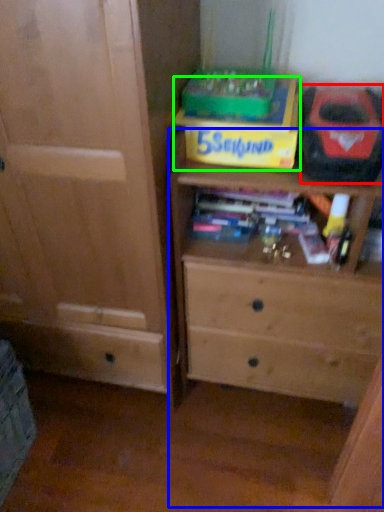
Question: Considering the real-world distances, which object is farthest from kit (highlighted by a red box)? chest of drawers (highlighted by a blue box) or cardboard box (highlighted by a green box)?

Choices:
 (A) chest of drawers
 (B) cardboard box

Answer: (A)